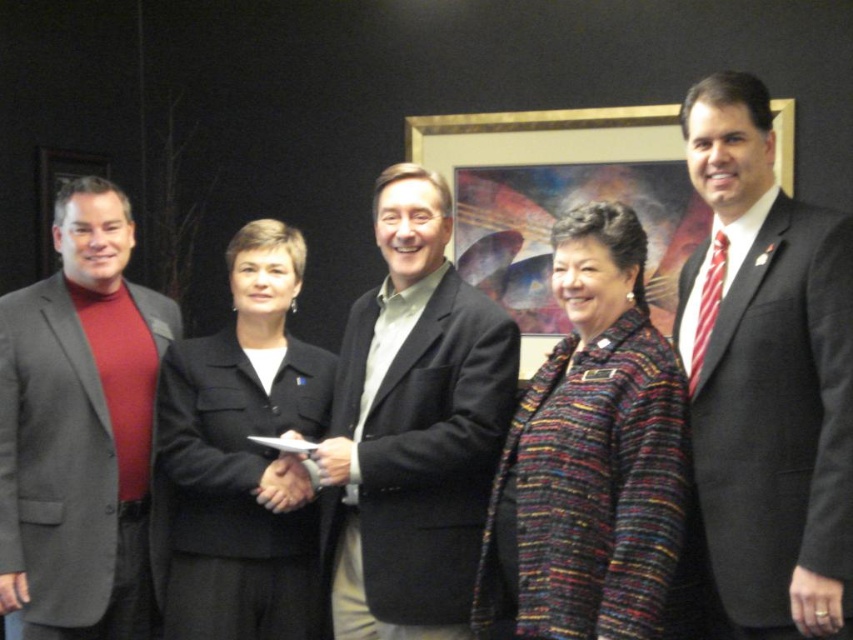
You are organizing a photoshoot and need to arrange the dark gray suit at center and the matte gray blazer at left in a line from left to right based on their positions in the original image. Which should come first?

The matte gray blazer at left should come first in the left position because it is positioned to the left of the dark gray suit at center in the original image.

Looking at this image, you are a photographer at a formal event. You need to capture a photo of the dark gray suit at center and the matte gray blazer at left. Based on their heights, which one should you adjust the camera angle for to ensure both are in focus?

The dark gray suit at center is shorter than the matte gray blazer at left, so you should lower the camera angle slightly to ensure the shorter dark gray suit at center is in focus while keeping the taller matte gray blazer at left visible.